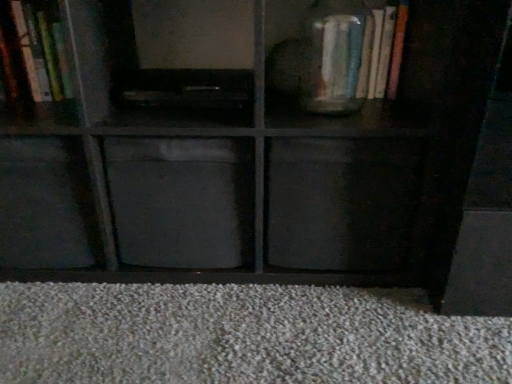
Question: Is matte gray cabinet at center, which is the third cabinet in left-to-right order, taller or shorter than black matte drawer at center?

Choices:
 (A) short
 (B) tall

Answer: (A)

Question: Is matte gray cabinet at center, positioned as the first cabinet in right-to-left order, to the left or to the right of black matte drawer at center in the image?

Choices:
 (A) right
 (B) left

Answer: (B)

Question: Which object is the farthest from the matte black cube at lower left, marked as the 2th cabinet in a left-to-right arrangement?

Choices:
 (A) matte glass vase at upper right
 (B) black matte drawer at center
 (C) wooden bookshelf at upper left, acting as the first cabinet starting from the left
 (D) matte gray cabinet at center, positioned as the first cabinet in right-to-left order

Answer: (A)

Question: Which object is the closest to the matte black cube at lower left, positioned as the second cabinet in right-to-left order?

Choices:
 (A) matte glass vase at upper right
 (B) wooden bookshelf at upper left, acting as the 3th cabinet starting from the right
 (C) black matte drawer at center
 (D) matte gray cabinet at center, positioned as the first cabinet in right-to-left order

Answer: (D)